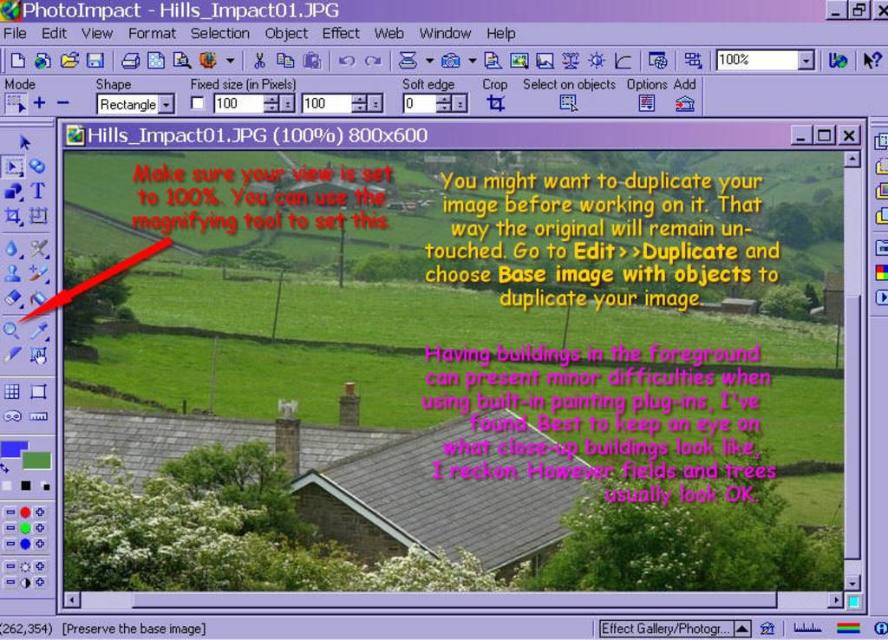
Does yellow text at upper center come in front of red text at upper left?

That is True.

Who is taller, yellow text at upper center or red text at upper left?

With more height is yellow text at upper center.

At what (x,y) coordinates should I click in order to perform the action: click on yellow text at upper center. Please return your answer as a coordinate pair (x, y). Looking at the image, I should click on (619, 230).

Is pink paper at upper center taller than red text at upper left?

No.

Can you confirm if pink paper at upper center is positioned to the left of red text at upper left?

Incorrect, pink paper at upper center is not on the left side of red text at upper left.

This screenshot has width=888, height=640. What are the coordinates of `pink paper at upper center` in the screenshot? It's located at (633, 417).

The image size is (888, 640). Identify the location of pink paper at upper center. (633, 417).

How much distance is there between yellow text at upper center and pink paper at upper center?

yellow text at upper center and pink paper at upper center are 162.46 feet apart.

Find the location of a particular element. The image size is (888, 640). yellow text at upper center is located at coordinates (619, 230).

Between point (609, 284) and point (560, 349), which one is positioned behind?

The point (609, 284) is more distant.

Locate an element on the screen. The width and height of the screenshot is (888, 640). yellow text at upper center is located at coordinates (619, 230).